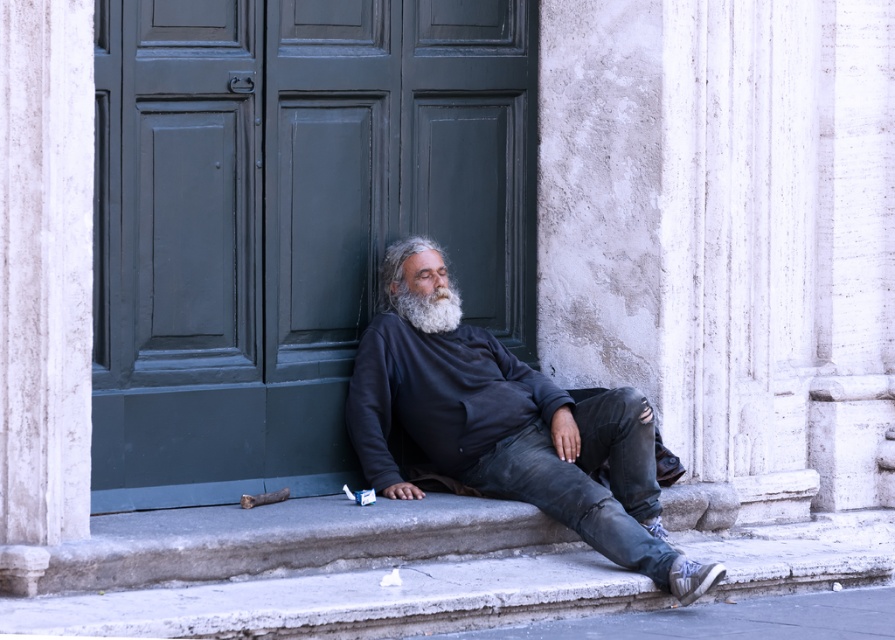
Who is more forward, (301, 3) or (642, 518)?

Point (642, 518) is more forward.

Is point (186, 368) closer to camera compared to point (442, 461)?

Yes.

Which is behind, point (166, 460) or point (534, 401)?

The point (534, 401) is more distant.

Locate an element on the screen. Image resolution: width=895 pixels, height=640 pixels. green matte door at center is located at coordinates (288, 220).

Consider the image. Can you confirm if dark blue sweatshirt at center is taller than white matte beard at center?

Indeed, dark blue sweatshirt at center has a greater height compared to white matte beard at center.

Looking at this image, who is lower down, dark blue sweatshirt at center or white matte beard at center?

Positioned lower is dark blue sweatshirt at center.

Which is behind, point (382, 484) or point (433, 324)?

The point (433, 324) is behind.

The image size is (895, 640). Identify the location of dark blue sweatshirt at center. (510, 429).

Can you confirm if green matte door at center is positioned to the right of white matte beard at center?

No, green matte door at center is not to the right of white matte beard at center.

Looking at this image, does green matte door at center have a greater width compared to white matte beard at center?

Indeed, green matte door at center has a greater width compared to white matte beard at center.

The image size is (895, 640). What do you see at coordinates (288, 220) in the screenshot?
I see `green matte door at center` at bounding box center [288, 220].

Where is `green matte door at center`? The height and width of the screenshot is (640, 895). green matte door at center is located at coordinates (288, 220).